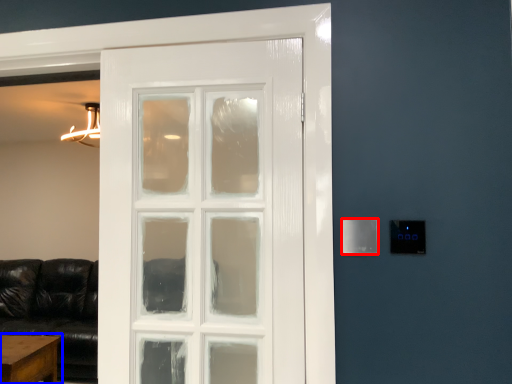
Question: Among these objects, which one is nearest to the camera, light switch (highlighted by a red box) or table (highlighted by a blue box)?

Choices:
 (A) light switch
 (B) table

Answer: (A)